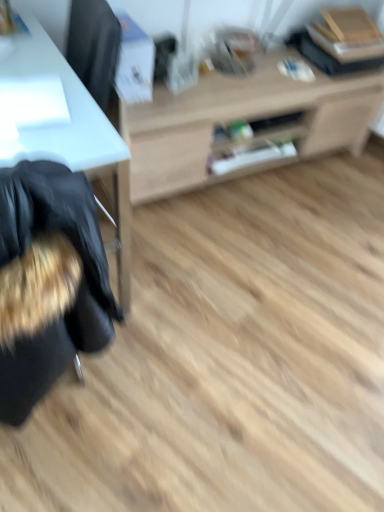
Identify the location of free location above white glossy desk at left (from a real-world perspective). (34, 92).